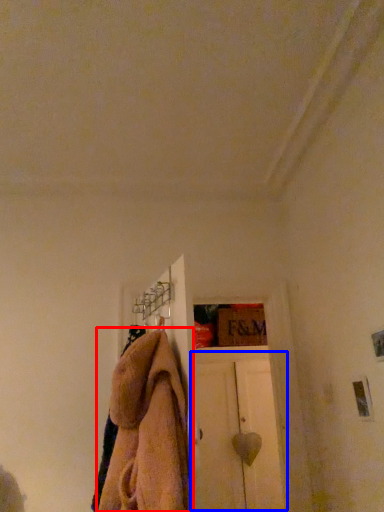
Question: Which object appears farthest to the camera in this image, towel (highlighted by a red box) or door (highlighted by a blue box)?

Choices:
 (A) towel
 (B) door

Answer: (B)